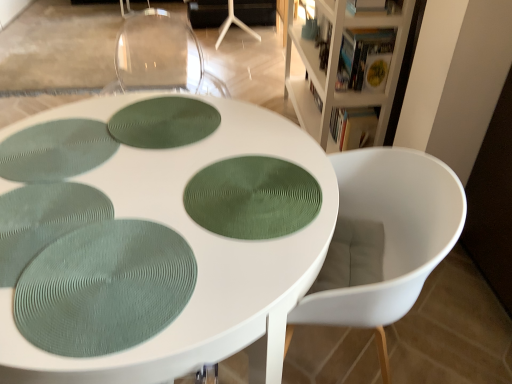
Question: Would you say white plastic chair at lower right is part of green textured placemat at center, the 3th oval from the front,'s contents?

Choices:
 (A) no
 (B) yes

Answer: (A)

Question: Does green textured placemat at center, which is the 1th oval in back-to-front order, come in front of white plastic chair at lower right?

Choices:
 (A) yes
 (B) no

Answer: (B)

Question: Considering the relative positions of green textured placemat at center, the 3th oval from the front, and white plastic chair at lower right in the image provided, is green textured placemat at center, the 3th oval from the front, to the right of white plastic chair at lower right from the viewer's perspective?

Choices:
 (A) yes
 (B) no

Answer: (B)

Question: From a real-world perspective, is green textured placemat at center, the 3th oval from the front, on white plastic chair at lower right?

Choices:
 (A) no
 (B) yes

Answer: (B)

Question: Is green textured placemat at center, arranged as the 3th oval when ordered from the bottom, smaller than white plastic chair at lower right?

Choices:
 (A) yes
 (B) no

Answer: (A)

Question: Is green textured placemat at center, the 3th oval from the front, not close to white plastic chair at lower right?

Choices:
 (A) no
 (B) yes

Answer: (A)

Question: Is green textured placemat at center, acting as the second oval starting from the back, smaller than green textured placemat at lower left, which is the first oval from front to back?

Choices:
 (A) no
 (B) yes

Answer: (B)

Question: Can you confirm if green textured placemat at center, positioned as the second oval in bottom-to-top order, is taller than green textured placemat at lower left, which is the first oval from front to back?

Choices:
 (A) no
 (B) yes

Answer: (A)

Question: Is green textured placemat at center, positioned as the second oval in bottom-to-top order, facing towards green textured placemat at lower left, the first oval from the bottom?

Choices:
 (A) yes
 (B) no

Answer: (B)

Question: Does green textured placemat at center, acting as the 2th oval starting from the front, touch green textured placemat at lower left, the first oval from the bottom?

Choices:
 (A) no
 (B) yes

Answer: (A)

Question: Considering the relative positions of green textured placemat at center, acting as the 2th oval starting from the front, and green textured placemat at lower left, the first oval from the bottom, in the image provided, is green textured placemat at center, acting as the 2th oval starting from the front, in front of green textured placemat at lower left, the first oval from the bottom,?

Choices:
 (A) no
 (B) yes

Answer: (A)

Question: Are white wood bookcase at upper right and green textured placemat at lower left, marked as the 3th oval in a back-to-front arrangement, beside each other?

Choices:
 (A) no
 (B) yes

Answer: (A)